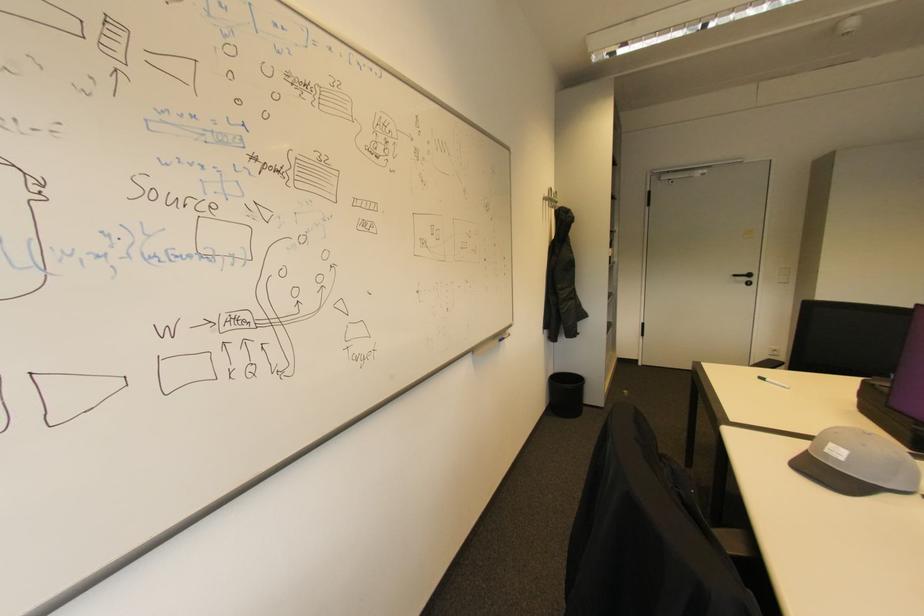
The location [779,386] corresponds to which object?

It corresponds to the green marker in the image.